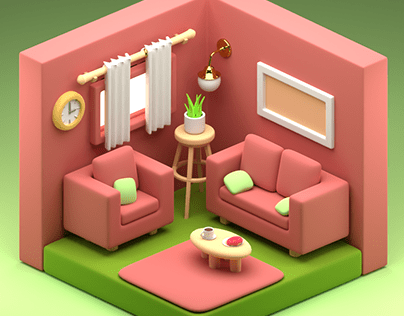
This screenshot has width=404, height=316. Find the location of `peach wall`. peach wall is located at coordinates (298, 109).